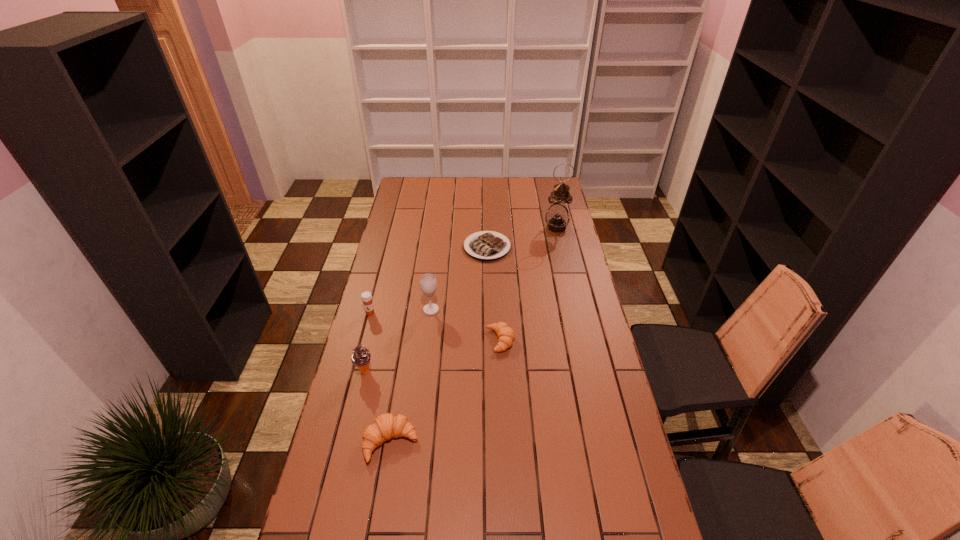
This screenshot has height=540, width=960. What are the coordinates of `vacant space that satisfies the following two spatial constraints: 1. on the front side of the sixth tallest object; 2. on the left side of the shortest object` in the screenshot? It's located at (489, 340).

The image size is (960, 540). Identify the location of vacant space that satisfies the following two spatial constraints: 1. on the label side of the medicine; 2. on the right side of the icecream. (355, 372).